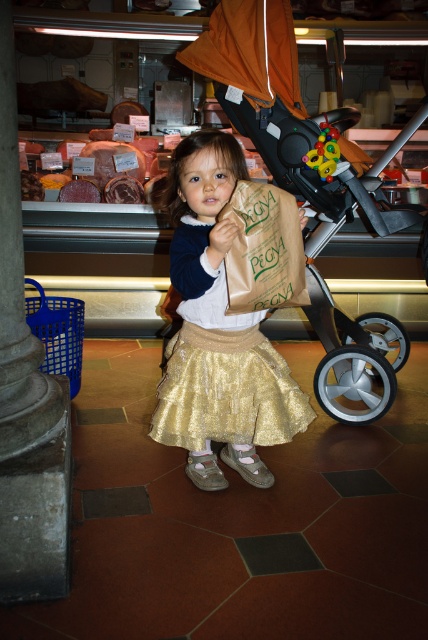
The girl is holding the brown paper bag at center and wearing the gold sequined skirt at center. Which item is wider?

The gold sequened skirt at center is wider than the brown paper bag at center.

The girl is holding a brown paper bag at center and wearing a gold shimmering skirt at center. Which item is larger in size?

The gold shimmering skirt at center is bigger than the brown paper bag at center.